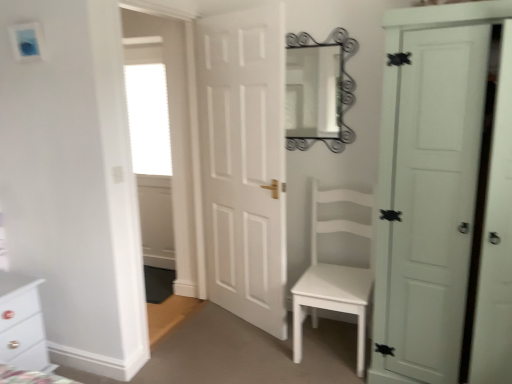
Describe the element at coordinates (332, 300) in the screenshot. I see `white matte chair at center` at that location.

Measure the distance between white matte door at right, the 1th door positioned from the right, and camera.

A distance of 1.57 meters exists between white matte door at right, the 1th door positioned from the right, and camera.

Locate an element on the screen. Image resolution: width=512 pixels, height=384 pixels. white matte door at center, the 1th door in the left-to-right sequence is located at coordinates click(244, 162).

The image size is (512, 384). What do you see at coordinates (148, 118) in the screenshot?
I see `white frosted glass window at upper left` at bounding box center [148, 118].

Where is `metallic silver mirror at upper center`? metallic silver mirror at upper center is located at coordinates (313, 92).

Does white glossy chest of drawers at lower left turn towards white matte chair at center?

No, white glossy chest of drawers at lower left is not oriented towards white matte chair at center.

Is white glossy chest of drawers at lower left positioned beyond the bounds of white matte chair at center?

Yes, white glossy chest of drawers at lower left is not within white matte chair at center.

Which of these two, white glossy chest of drawers at lower left or white matte chair at center, is smaller?

Smaller between the two is white glossy chest of drawers at lower left.

Between point (12, 339) and point (298, 304), which one is positioned behind?

The point (298, 304) is behind.

Can you confirm if white matte door at right, the 1th door positioned from the right, is shorter than metallic silver mirror at upper center?

In fact, white matte door at right, the 1th door positioned from the right, may be taller than metallic silver mirror at upper center.

Based on the photo, is white matte door at right, the 1th door positioned from the right, positioned beyond the bounds of metallic silver mirror at upper center?

That's correct, white matte door at right, the 1th door positioned from the right, is outside of metallic silver mirror at upper center.

Find the location of `mirror that appears above the white matte door at right, the 2th door from the left (from the image's perspective)`. mirror that appears above the white matte door at right, the 2th door from the left (from the image's perspective) is located at coordinates (313, 92).

Does white matte door at right, the 2th door from the left, come behind metallic silver mirror at upper center?

No, it is not.

Could white frosted glass window at upper left be considered to be inside metallic silver mirror at upper center?

No, white frosted glass window at upper left is located outside of metallic silver mirror at upper center.

I want to click on window on the left of metallic silver mirror at upper center, so click(148, 118).

Considering the positions of points (300, 128) and (164, 130), is point (300, 128) closer to camera compared to point (164, 130)?

Yes, it is.

Considering the relative sizes of metallic silver mirror at upper center and white frosted glass window at upper left in the image provided, is metallic silver mirror at upper center wider than white frosted glass window at upper left?

No, metallic silver mirror at upper center is not wider than white frosted glass window at upper left.

Would you say white matte door at center, which appears as the second door when viewed from the right, is to the left or to the right of white glossy chest of drawers at lower left in the picture?

white matte door at center, which appears as the second door when viewed from the right, is positioned on white glossy chest of drawers at lower left's right side.

Is white matte door at center, the 1th door in the left-to-right sequence, in contact with white glossy chest of drawers at lower left?

white matte door at center, the 1th door in the left-to-right sequence, is not next to white glossy chest of drawers at lower left, and they're not touching.

Considering the points (211, 123) and (36, 331), which point is behind, point (211, 123) or point (36, 331)?

Point (211, 123)

Considering the positions of objects white frosted glass window at upper left and white matte chair at center in the image provided, who is in front, white frosted glass window at upper left or white matte chair at center?

white matte chair at center is closer to the camera.

Is white frosted glass window at upper left oriented away from white matte chair at center?

No, white matte chair at center is not at the back of white frosted glass window at upper left.

Can you see white frosted glass window at upper left touching white matte chair at center?

No.

Does white frosted glass window at upper left appear on the left side of white matte chair at center?

Yes, white frosted glass window at upper left is to the left of white matte chair at center.

From the image's perspective, which object appears higher, metallic silver mirror at upper center or white matte door at right, the 1th door positioned from the right?

metallic silver mirror at upper center.

Is white matte door at right, the 1th door positioned from the right, at the back of metallic silver mirror at upper center?

No, metallic silver mirror at upper center is not facing the opposite direction of white matte door at right, the 1th door positioned from the right.

Considering the positions of objects metallic silver mirror at upper center and white matte door at right, the 1th door positioned from the right, in the image provided, who is more to the left, metallic silver mirror at upper center or white matte door at right, the 1th door positioned from the right,?

From the viewer's perspective, metallic silver mirror at upper center appears more on the left side.

What's the angular difference between metallic silver mirror at upper center and white matte door at right, the 1th door positioned from the right,'s facing directions?

The angle between the facing direction of metallic silver mirror at upper center and the facing direction of white matte door at right, the 1th door positioned from the right, is 1.18 degrees.

From a real-world perspective, which object stands above the other?

white matte door at right, the 1th door positioned from the right, is physically above.

Where is `the 1st door above when counting from the white glossy chest of drawers at lower left (from the image's perspective)`? This screenshot has height=384, width=512. the 1st door above when counting from the white glossy chest of drawers at lower left (from the image's perspective) is located at coordinates (442, 196).

Between white glossy chest of drawers at lower left and white matte door at right, the 1th door positioned from the right, which one has smaller size?

white glossy chest of drawers at lower left.

The width and height of the screenshot is (512, 384). I want to click on chest of drawers in front of the white matte chair at center, so click(22, 323).

The width and height of the screenshot is (512, 384). What are the coordinates of `mirror that is behind the white matte door at right, the 2th door from the left` in the screenshot? It's located at (313, 92).

Estimate the real-world distances between objects in this image. Which object is closer to white matte door at center, which appears as the second door when viewed from the right, white frosted glass window at upper left or white glossy chest of drawers at lower left?

Among the two, white frosted glass window at upper left is located nearer to white matte door at center, which appears as the second door when viewed from the right.

Based on the photo, which object lies nearer to the anchor point white glossy chest of drawers at lower left, white frosted glass window at upper left or white matte door at center, the 1th door in the left-to-right sequence?

Among the two, white matte door at center, the 1th door in the left-to-right sequence, is located nearer to white glossy chest of drawers at lower left.

Consider the image. Estimate the real-world distances between objects in this image. Which object is closer to white glossy chest of drawers at lower left, white matte chair at center or white matte door at right, the 1th door positioned from the right?

white matte chair at center.

Based on their spatial positions, is white frosted glass window at upper left or white glossy chest of drawers at lower left further from white matte door at right, the 1th door positioned from the right?

Among the two, white frosted glass window at upper left is located further to white matte door at right, the 1th door positioned from the right.

From the image, which object appears to be nearer to white frosted glass window at upper left, white matte door at center, the 1th door in the left-to-right sequence, or white glossy chest of drawers at lower left?

white matte door at center, the 1th door in the left-to-right sequence, is positioned closer to the anchor white frosted glass window at upper left.

In the scene shown: When comparing their distances from white matte door at right, the 1th door positioned from the right, does white glossy chest of drawers at lower left or white matte chair at center seem closer?

The object closer to white matte door at right, the 1th door positioned from the right, is white matte chair at center.

Which object lies further to the anchor point white matte door at center, which appears as the second door when viewed from the right, white glossy chest of drawers at lower left or white matte door at right, the 1th door positioned from the right?

Based on the image, white glossy chest of drawers at lower left appears to be further to white matte door at center, which appears as the second door when viewed from the right.

Which object lies further to the anchor point metallic silver mirror at upper center, white glossy chest of drawers at lower left or white matte door at center, which appears as the second door when viewed from the right?

white glossy chest of drawers at lower left.

Locate an element on the screen. The image size is (512, 384). mirror between white glossy chest of drawers at lower left and white matte chair at center is located at coordinates (313, 92).

In order to click on window located between white glossy chest of drawers at lower left and metallic silver mirror at upper center in the left-right direction in this screenshot , I will do `click(148, 118)`.

Where is `door situated between white glossy chest of drawers at lower left and metallic silver mirror at upper center from left to right`? This screenshot has height=384, width=512. door situated between white glossy chest of drawers at lower left and metallic silver mirror at upper center from left to right is located at coordinates (244, 162).

Identify the location of table between white glossy chest of drawers at lower left and white matte door at right, the 2th door from the left, in the horizontal direction. click(332, 300).